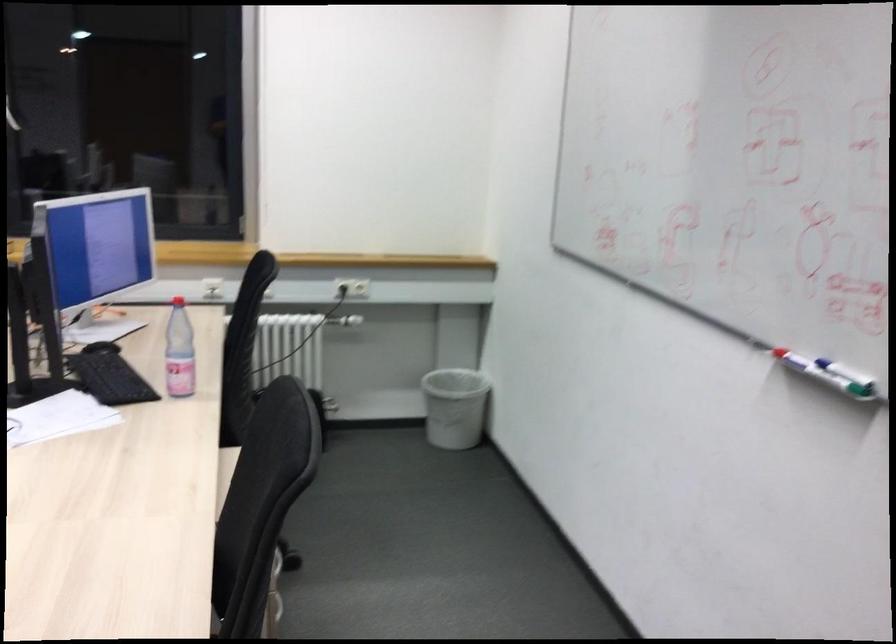
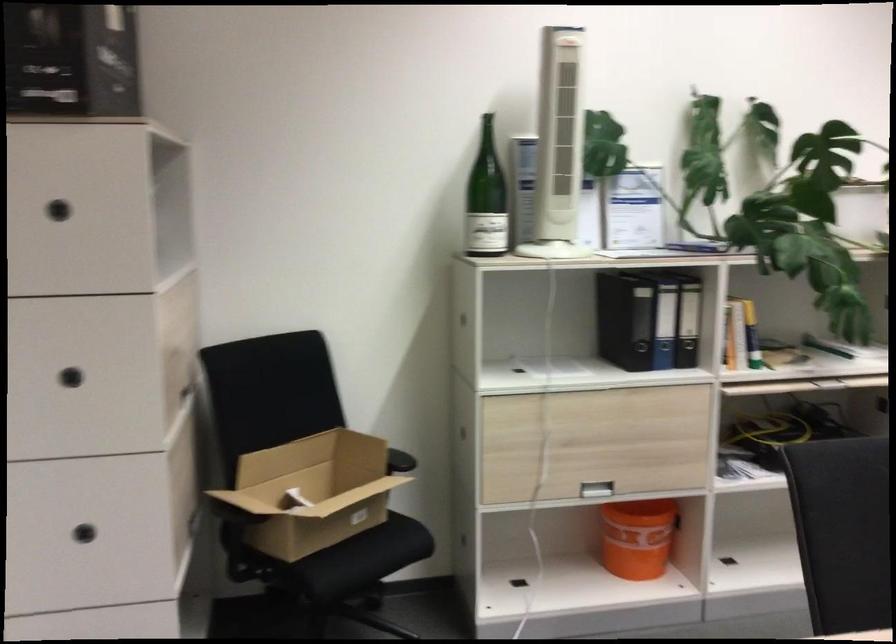
Question: The camera is either moving clockwise (left) or counter-clockwise (right) around the object. The first image is from the beginning of the video and the second image is from the end. Is the camera moving left or right when shooting the video?

Choices:
 (A) Left
 (B) Right

Answer: (B)